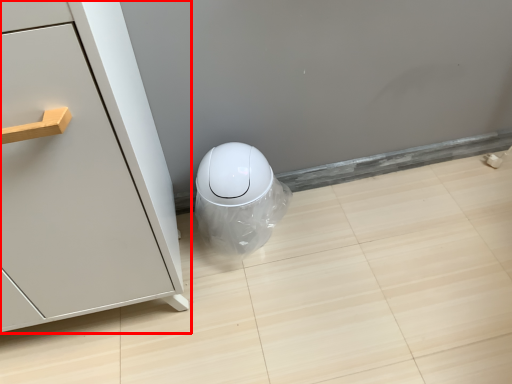
Question: Observing the image, what is the correct spatial positioning of furniture (annotated by the red box) in reference to porcelain?

Choices:
 (A) left
 (B) right

Answer: (A)